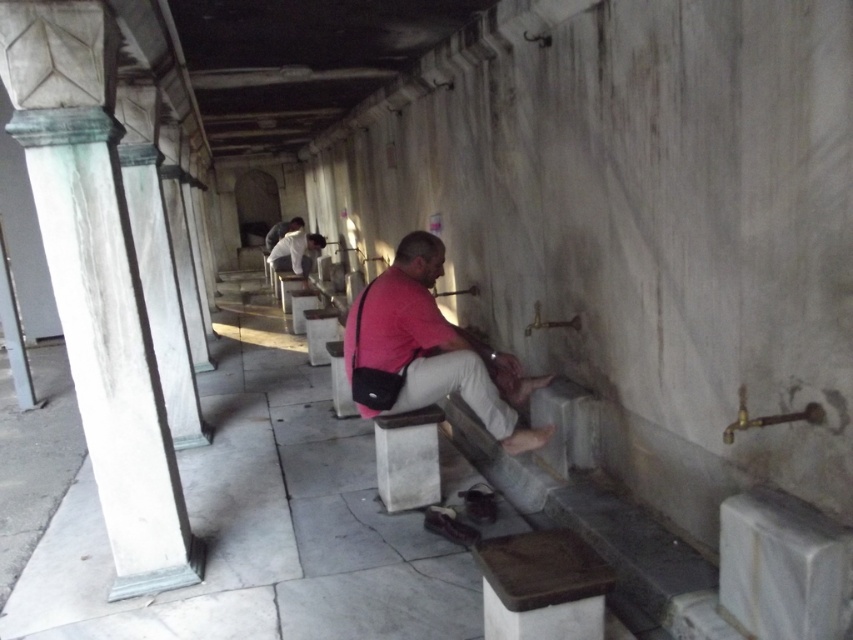
From the picture: You are an interior designer observing the corridor with the pink matte shirt at center and the matte pink shirt at center. Which one is bigger?

The pink matte shirt at center is larger in size compared to the matte pink shirt at center.

You are standing at the entrance of the corridor and want to reach the matte pink shirt at center without passing by the white marble pillar at left. Is this possible given the corridor layout?

The distance between the white marble pillar at left and the matte pink shirt at center is 10.69 meters. Since the corridor is long and narrow with benches on one side, you can walk along the opposite side of the benches to avoid the white marble pillar at left and reach the matte pink shirt at center directly.